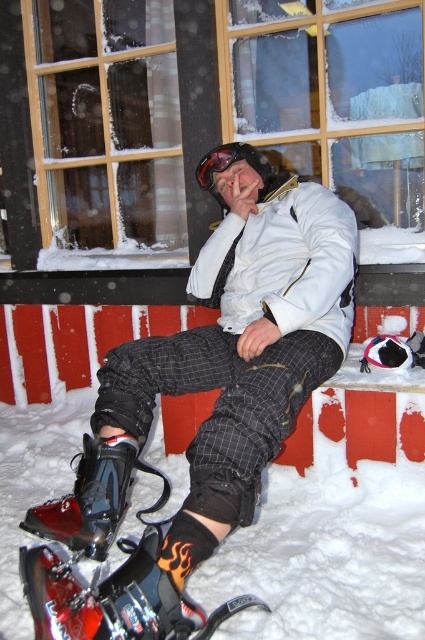
Question: Which point is farther to the camera?

Choices:
 (A) (42, 560)
 (B) (209, 161)

Answer: (B)

Question: Does matte black snowboard at center have a lesser width compared to glossy plastic goggles at center?

Choices:
 (A) yes
 (B) no

Answer: (B)

Question: Which point is closer to the camera?

Choices:
 (A) (118, 496)
 (B) (95, 596)
 (C) (289, 433)

Answer: (B)

Question: Is glossy black ski boot at lower left to the left of glossy plastic goggles at center from the viewer's perspective?

Choices:
 (A) yes
 (B) no

Answer: (A)

Question: Observing the image, what is the correct spatial positioning of matte black snowboard at center in reference to flame-patterned plastic snowshoe at lower left?

Choices:
 (A) below
 (B) above

Answer: (B)

Question: Which object is farther from the camera taking this photo?

Choices:
 (A) glossy black ski boot at lower left
 (B) flame-patterned plastic snowshoe at lower left
 (C) glossy plastic goggles at center

Answer: (C)